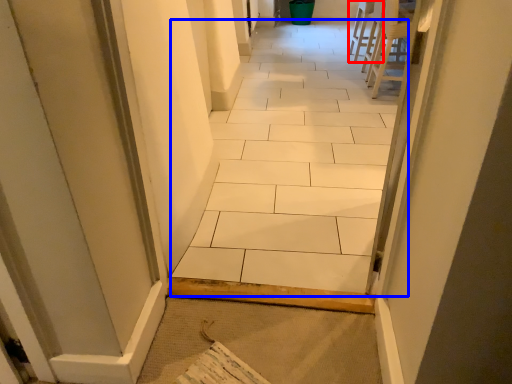
Question: Which of the following is the closest to the observer, chair (highlighted by a red box) or ceramic tile (highlighted by a blue box)?

Choices:
 (A) chair
 (B) ceramic tile

Answer: (B)